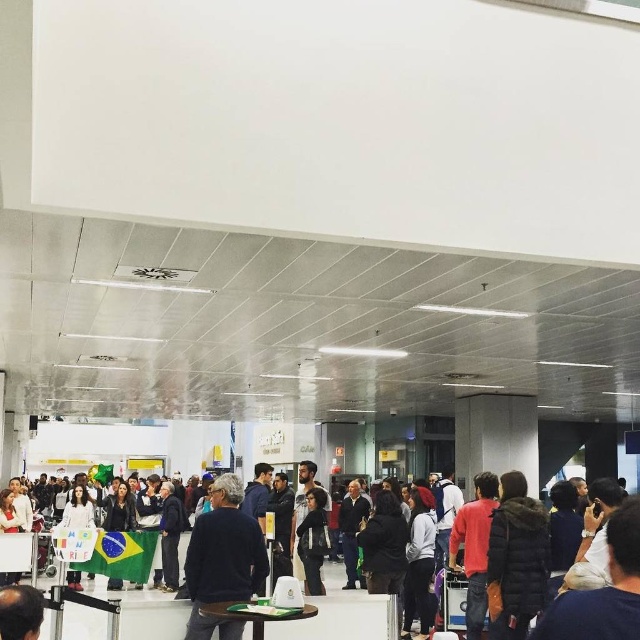
Question: Among these points, which one is farthest from the camera?

Choices:
 (A) (140, 637)
 (B) (506, 560)
 (C) (211, 556)

Answer: (B)

Question: Estimate the real-world distances between objects in this image. Which object is farther from the dark blue sweater at center?

Choices:
 (A) dark brown fur coat at center
 (B) red matte jacket at center

Answer: (B)

Question: Does dark blue sweater at center have a larger size compared to black leather jacket at center?

Choices:
 (A) yes
 (B) no

Answer: (A)

Question: Does dark blue jacket at center appear on the left side of red matte jacket at center?

Choices:
 (A) no
 (B) yes

Answer: (B)

Question: Is dark blue jacket at center to the left of red matte jacket at center from the viewer's perspective?

Choices:
 (A) no
 (B) yes

Answer: (B)

Question: Which point appears closest to the camera in this image?

Choices:
 (A) click(161, 624)
 (B) click(541, 506)

Answer: (A)